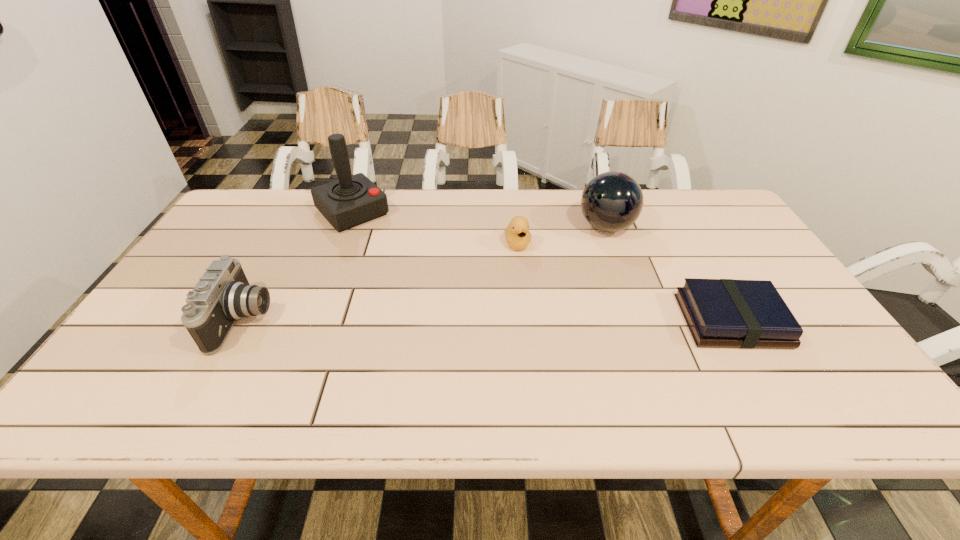
I want to click on empty location between the third object from right to left and the second object from right to left, so click(562, 235).

This screenshot has width=960, height=540. I want to click on free point between the third tallest object and the fourth shortest object, so click(x=425, y=273).

Identify the location of empty space between the fourth tallest object and the rightmost object. (625, 282).

Where is `free spot between the book and the duckling`? The width and height of the screenshot is (960, 540). free spot between the book and the duckling is located at coordinates (625, 282).

Image resolution: width=960 pixels, height=540 pixels. Identify the location of vacant space that is in between the fourth shortest object and the duckling. (562, 235).

Find the location of a particular element. This screenshot has width=960, height=540. free space between the duckling and the third tallest object is located at coordinates [381, 282].

Locate an element on the screen. Image resolution: width=960 pixels, height=540 pixels. vacant space that is in between the fourth tallest object and the rightmost object is located at coordinates (625, 282).

Find the location of `vacant region between the rightmost object and the fourth shortest object`. vacant region between the rightmost object and the fourth shortest object is located at coordinates (669, 274).

Where is `blank region between the shortest object and the camera`? This screenshot has height=540, width=960. blank region between the shortest object and the camera is located at coordinates (488, 320).

Identify which object is the third closest to the third tallest object. Please provide its 2D coordinates. Your answer should be formatted as a tuple, i.e. [(x, y)], where the tuple contains the x and y coordinates of a point satisfying the conditions above.

[(612, 201)]